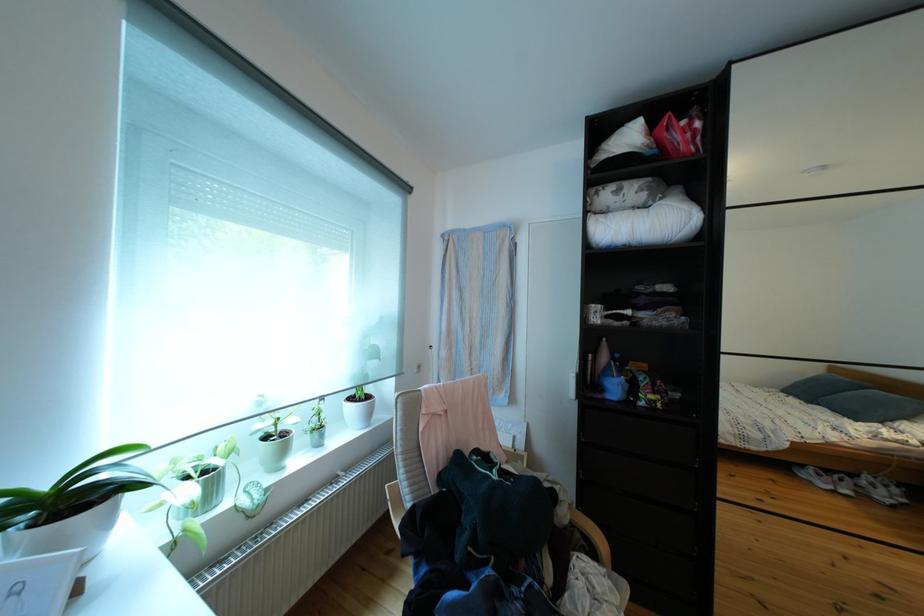
Find where to grasp the wooden chair armrest. Please return your answer as a coordinate pair (x, y).

(596, 543)